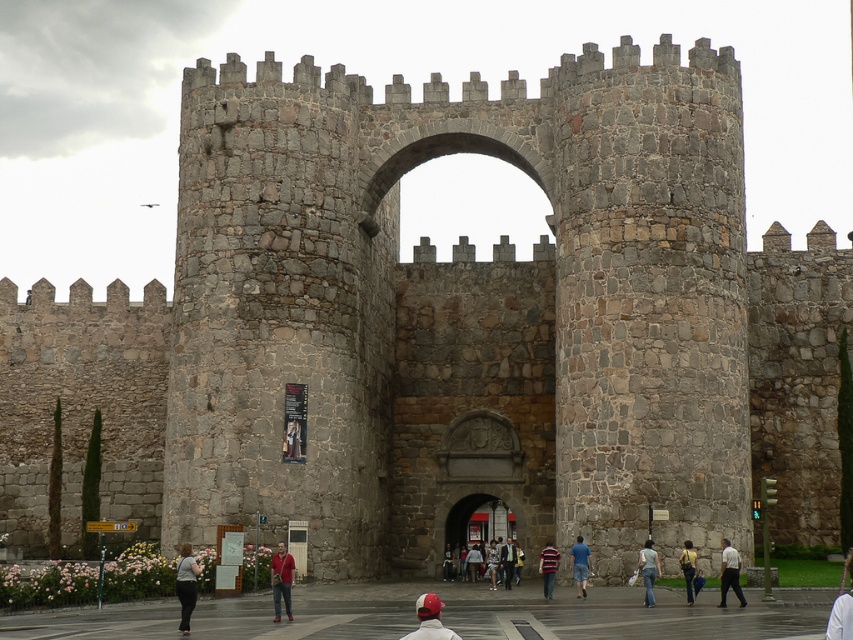
Who is taller, red cap at center or white matte shirt at center?

Standing taller between the two is red cap at center.

Is red cap at center positioned in front of white matte shirt at center?

Yes, red cap at center is closer to the viewer.

What do you see at coordinates (428, 620) in the screenshot?
I see `red cap at center` at bounding box center [428, 620].

At what (x,y) coordinates should I click in order to perform the action: click on red cap at center. Please return your answer as a coordinate pair (x, y). The height and width of the screenshot is (640, 853). Looking at the image, I should click on (428, 620).

Does matte red shirt at center appear under white fabric at center?

Actually, matte red shirt at center is above white fabric at center.

I want to click on matte red shirt at center, so [281, 580].

The image size is (853, 640). What are the coordinates of `matte red shirt at center` in the screenshot? It's located at (281, 580).

From the picture: Who is positioned more to the right, striped cotton shirt at center or yellow-green fabric bag at center?

yellow-green fabric bag at center

Can you confirm if striped cotton shirt at center is positioned above yellow-green fabric bag at center?

No.

Which is in front, point (541, 568) or point (691, 547)?

Point (691, 547) is more forward.

Where is `striped cotton shirt at center`? striped cotton shirt at center is located at coordinates (548, 566).